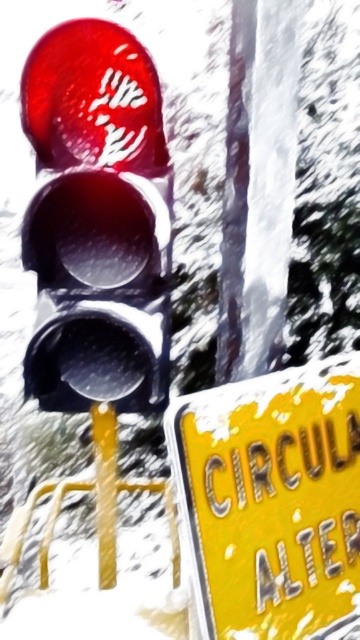
Question: Which point is closer to the camera?

Choices:
 (A) (300, 422)
 (B) (96, 282)

Answer: (A)

Question: Can you confirm if matte glass traffic light at left is thinner than yellow matte sign at lower right?

Choices:
 (A) yes
 (B) no

Answer: (A)

Question: Considering the relative positions of matte glass traffic light at left and yellow matte sign at lower right in the image provided, where is matte glass traffic light at left located with respect to yellow matte sign at lower right?

Choices:
 (A) right
 (B) left

Answer: (B)

Question: Among these points, which one is farthest from the camera?

Choices:
 (A) (253, 544)
 (B) (74, 131)

Answer: (B)

Question: Is matte glass traffic light at left further to the viewer compared to yellow matte sign at lower right?

Choices:
 (A) no
 (B) yes

Answer: (B)